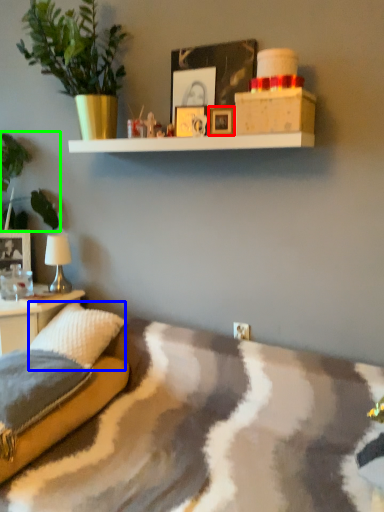
Question: Which is farther away from picture frame (highlighted by a red box)? pillow (highlighted by a blue box) or plant (highlighted by a green box)?

Choices:
 (A) pillow
 (B) plant

Answer: (B)